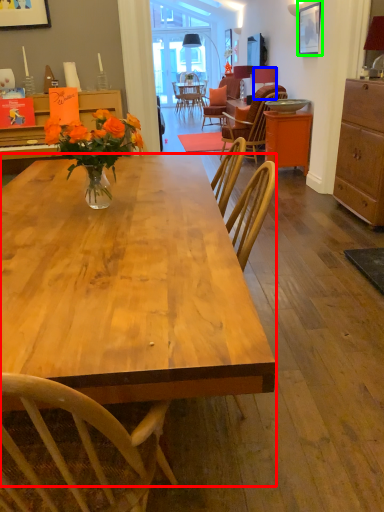
Question: Which is nearer to the desk (highlighted by a red box)? lamp (highlighted by a blue box) or picture frame (highlighted by a green box).

Choices:
 (A) lamp
 (B) picture frame

Answer: (B)